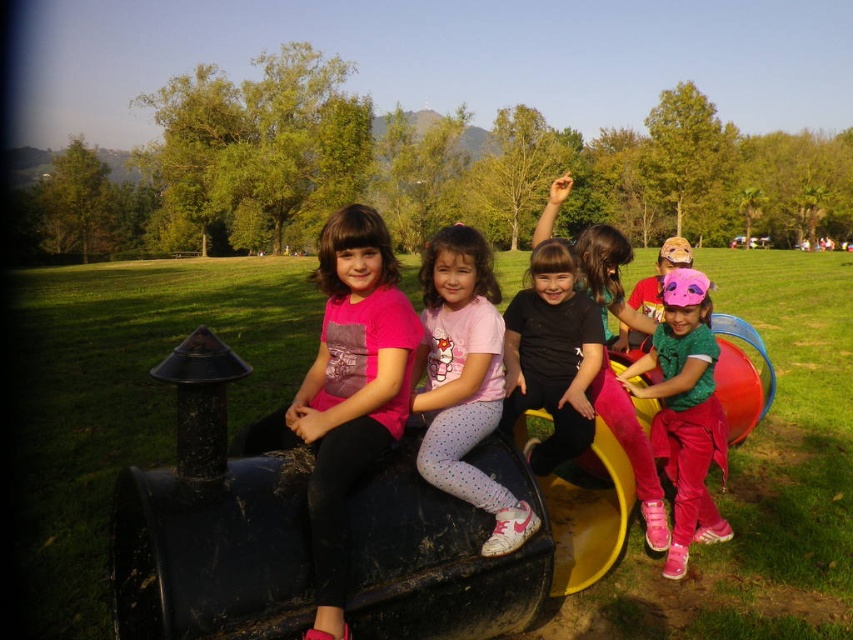
Find the location of a particular element. matte pink shirt at left is located at coordinates (351, 388).

Measure the distance between point (373, 337) and camera.

A distance of 9.31 feet exists between point (373, 337) and camera.

Locate an element on the screen. This screenshot has height=640, width=853. matte pink shirt at left is located at coordinates click(351, 388).

Which is behind, point (677, 449) or point (532, 396)?

Positioned behind is point (677, 449).

Where is `pink fabric mask at center`? This screenshot has height=640, width=853. pink fabric mask at center is located at coordinates (685, 412).

The height and width of the screenshot is (640, 853). Find the location of `pink fabric mask at center`. pink fabric mask at center is located at coordinates (685, 412).

Does matte pink shirt at left have a larger size compared to pink fabric mask at center?

No.

Does matte pink shirt at left have a greater height compared to pink fabric mask at center?

No, matte pink shirt at left is not taller than pink fabric mask at center.

Find the location of `matte pink shirt at left`. matte pink shirt at left is located at coordinates [351, 388].

What are the coordinates of `matte pink shirt at left` in the screenshot? It's located at (351, 388).